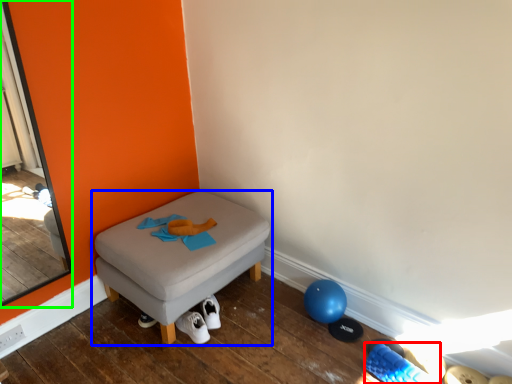
Question: Considering the real-world distances, which object is closest to footwear (highlighted by a red box)? furniture (highlighted by a blue box) or screen door (highlighted by a green box).

Choices:
 (A) furniture
 (B) screen door

Answer: (A)